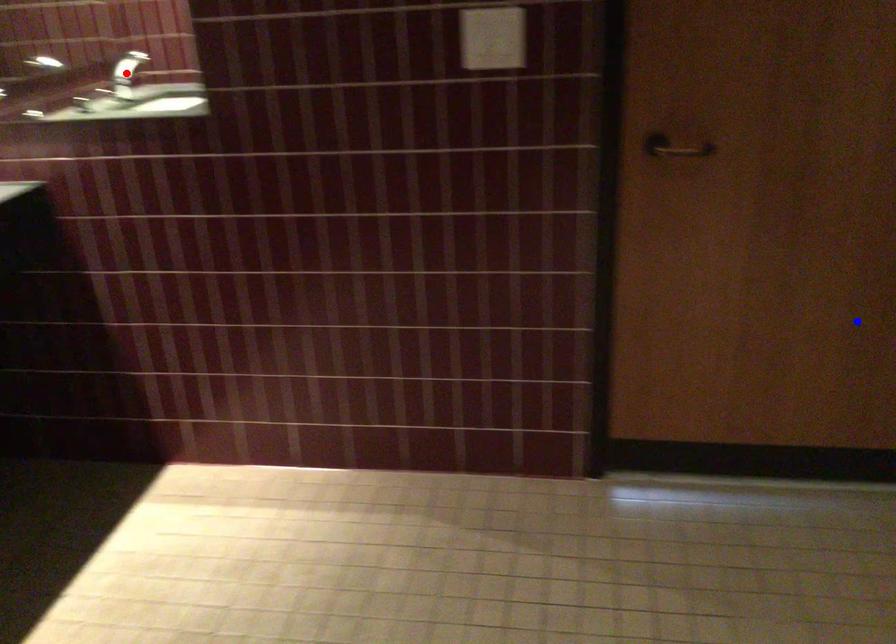
Question: Which of the two points in the image is closer to the camera?

Choices:
 (A) Blue point is closer.
 (B) Red point is closer.

Answer: (A)